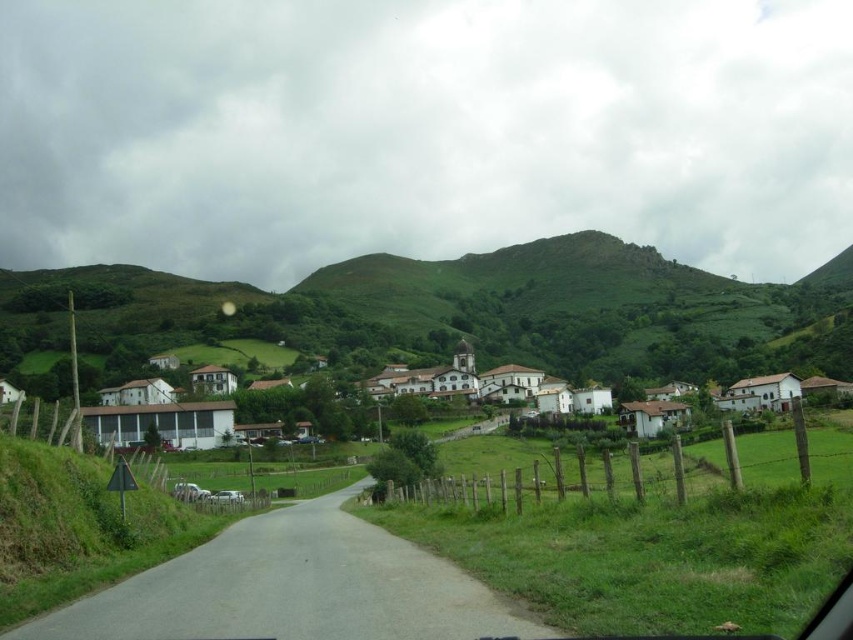
You are driving along a rural road and see a green grassy hill at center and white matte houses at center in the distance. Which of these two objects appears wider from your current viewpoint?

The green grassy hill at center appears wider than the white matte houses at center because its width is larger than that of the white matte houses at center.

You are driving along a rural road and see the green grassy hill at center. Can you estimate its location in terms of coordinates?

The green grassy hill at center is located at coordinates point (459, 310).

You are driving along the road and notice the green grassy hill at center and the white matte houses at center in the distance. Which of these two objects appears bigger in the scene?

The green grassy hill at center appears larger than the white matte houses at center in the scene.